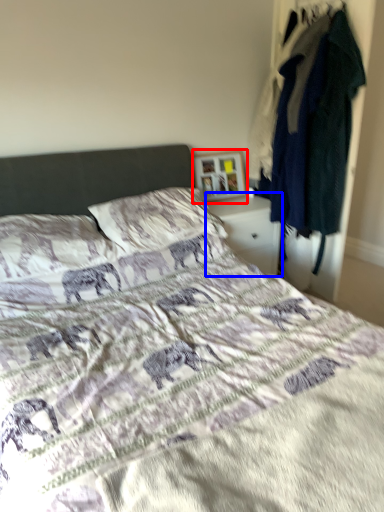
Question: Among these objects, which one is farthest to the camera, picture frame (highlighted by a red box) or nightstand (highlighted by a blue box)?

Choices:
 (A) picture frame
 (B) nightstand

Answer: (A)